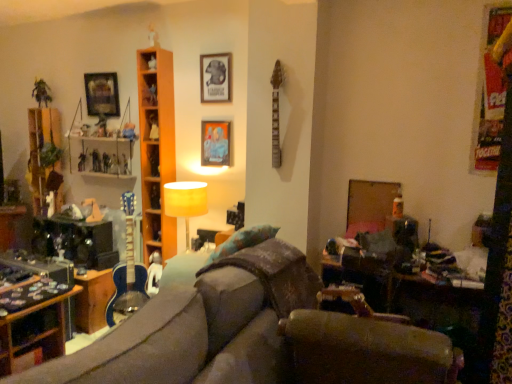
Question: Considering the relative sizes of metallic silver figurine at upper left, positioned as the 4th toy in right-to-left order, and matte black picture frame at upper center, which appears as the 1th picture frame when viewed from the right, in the image provided, is metallic silver figurine at upper left, positioned as the 4th toy in right-to-left order, thinner than matte black picture frame at upper center, which appears as the 1th picture frame when viewed from the right,?

Choices:
 (A) yes
 (B) no

Answer: (B)

Question: Does metallic silver figurine at upper left, the second toy viewed from the left, have a larger size compared to matte black picture frame at upper center, which is counted as the 3th picture frame, starting from the left?

Choices:
 (A) no
 (B) yes

Answer: (A)

Question: Is metallic silver figurine at upper left, positioned as the 4th toy in right-to-left order, turned away from matte black picture frame at upper center, which is counted as the 3th picture frame, starting from the left?

Choices:
 (A) yes
 (B) no

Answer: (B)

Question: Are metallic silver figurine at upper left, the second toy viewed from the left, and matte black picture frame at upper center, which is counted as the 3th picture frame, starting from the left, far apart?

Choices:
 (A) yes
 (B) no

Answer: (A)

Question: Does metallic silver figurine at upper left, positioned as the 4th toy in right-to-left order, come behind matte black picture frame at upper center, which is counted as the 3th picture frame, starting from the left?

Choices:
 (A) no
 (B) yes

Answer: (B)

Question: Considering the positions of wooden table at lower right and metallic silver picture frame at upper left, acting as the 1th picture frame starting from the back, in the image, is wooden table at lower right wider or thinner than metallic silver picture frame at upper left, acting as the 1th picture frame starting from the back,?

Choices:
 (A) thin
 (B) wide

Answer: (B)

Question: Considering the positions of wooden table at lower right and metallic silver picture frame at upper left, acting as the 1th picture frame starting from the back, in the image, is wooden table at lower right taller or shorter than metallic silver picture frame at upper left, acting as the 1th picture frame starting from the back,?

Choices:
 (A) tall
 (B) short

Answer: (A)

Question: From a real-world perspective, relative to metallic silver picture frame at upper left, acting as the 1th picture frame starting from the back, is wooden table at lower right vertically above or below?

Choices:
 (A) above
 (B) below

Answer: (B)

Question: Based on their positions, is wooden table at lower right located to the left or right of metallic silver picture frame at upper left, acting as the 1th picture frame starting from the back?

Choices:
 (A) left
 (B) right

Answer: (B)

Question: Relative to shiny plastic action figure at left, which ranks as the 3th toy in right-to-left order, is wooden table at lower right in front or behind?

Choices:
 (A) behind
 (B) front

Answer: (B)

Question: From a real-world perspective, relative to shiny plastic action figure at left, which ranks as the 3th toy in right-to-left order, is wooden table at lower right vertically above or below?

Choices:
 (A) above
 (B) below

Answer: (B)

Question: Considering the positions of wooden table at lower right and shiny plastic action figure at left, which ranks as the 3th toy in right-to-left order, in the image, is wooden table at lower right taller or shorter than shiny plastic action figure at left, which ranks as the 3th toy in right-to-left order,?

Choices:
 (A) tall
 (B) short

Answer: (A)

Question: In the image, is wooden table at lower right on the left side or the right side of shiny plastic action figure at left, which is the 3th toy in left-to-right order?

Choices:
 (A) right
 (B) left

Answer: (A)

Question: Is metallic silver toy at center, positioned as the second toy in right-to-left order, bigger or smaller than matte black picture frame at upper center, which ranks as the 1th picture frame in front-to-back order?

Choices:
 (A) small
 (B) big

Answer: (A)

Question: Looking at their shapes, would you say metallic silver toy at center, positioned as the second toy in right-to-left order, is wider or thinner than matte black picture frame at upper center, which appears as the 1th picture frame when viewed from the right?

Choices:
 (A) thin
 (B) wide

Answer: (B)